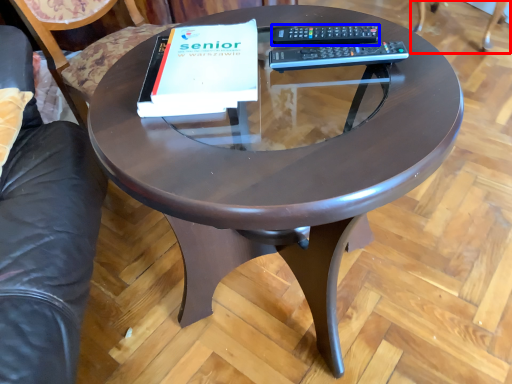
Question: Which object is further to the camera taking this photo, swivel chair (highlighted by a red box) or remote (highlighted by a blue box)?

Choices:
 (A) swivel chair
 (B) remote

Answer: (A)